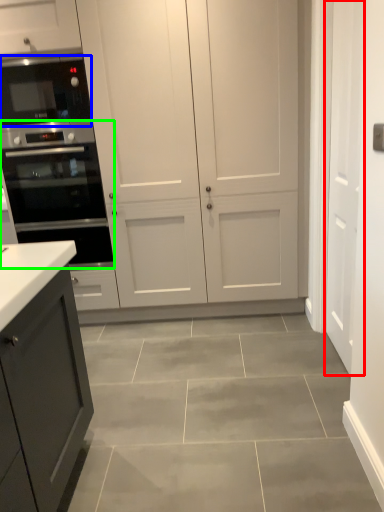
Question: Which is nearer to the door (highlighted by a red box)? microwave oven (highlighted by a blue box) or oven (highlighted by a green box).

Choices:
 (A) microwave oven
 (B) oven

Answer: (B)